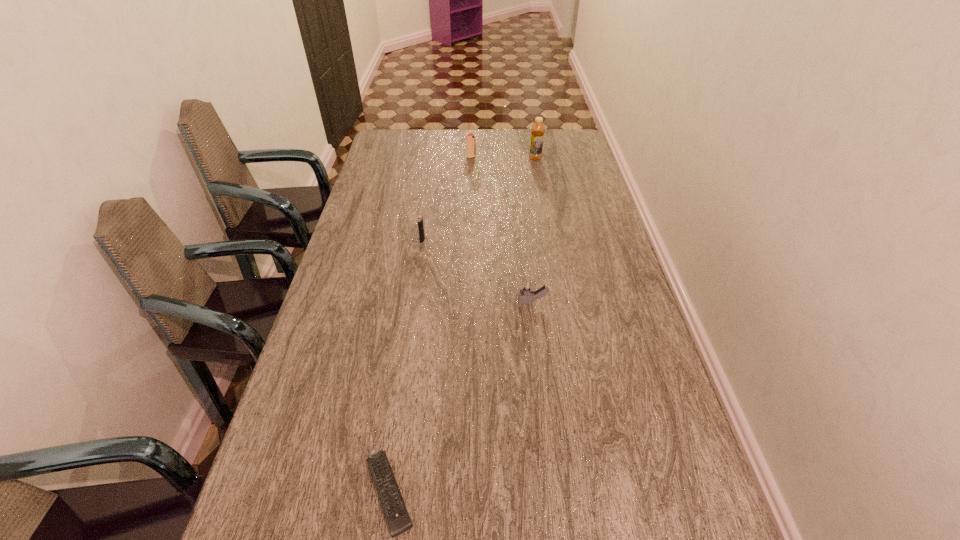
I want to click on the third closest object to the farthest igniter, so click(x=526, y=289).

Point out which object is positioned as the nearest to the third object from left to right. Please provide its 2D coordinates. Your answer should be formatted as a tuple, i.e. [(x, y)], where the tuple contains the x and y coordinates of a point satisfying the conditions above.

[(538, 129)]

Locate an element on the screen. This screenshot has width=960, height=540. igniter that is the closest to the second object from right to left is located at coordinates (420, 219).

Image resolution: width=960 pixels, height=540 pixels. Find the location of `igniter that stands as the second closest to the third nearest object`. igniter that stands as the second closest to the third nearest object is located at coordinates (470, 139).

Find the location of a particular element. vacant space that satisfies the following two spatial constraints: 1. on the back side of the shortest object; 2. on the left side of the second igniter from right to left is located at coordinates (437, 157).

The width and height of the screenshot is (960, 540). What are the coordinates of `vacant space that satisfies the following two spatial constraints: 1. on the back side of the bottle; 2. on the left side of the second farthest igniter` in the screenshot? It's located at (435, 159).

This screenshot has width=960, height=540. I want to click on free space that satisfies the following two spatial constraints: 1. on the front side of the third farthest object; 2. on the right side of the fourth farthest object, so click(413, 302).